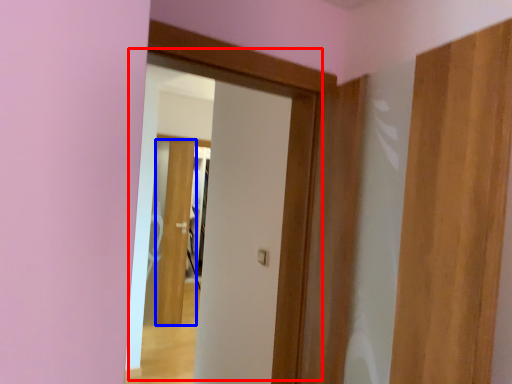
Question: Which object appears farthest to the camera in this image, door (highlighted by a red box) or door (highlighted by a blue box)?

Choices:
 (A) door
 (B) door

Answer: (B)